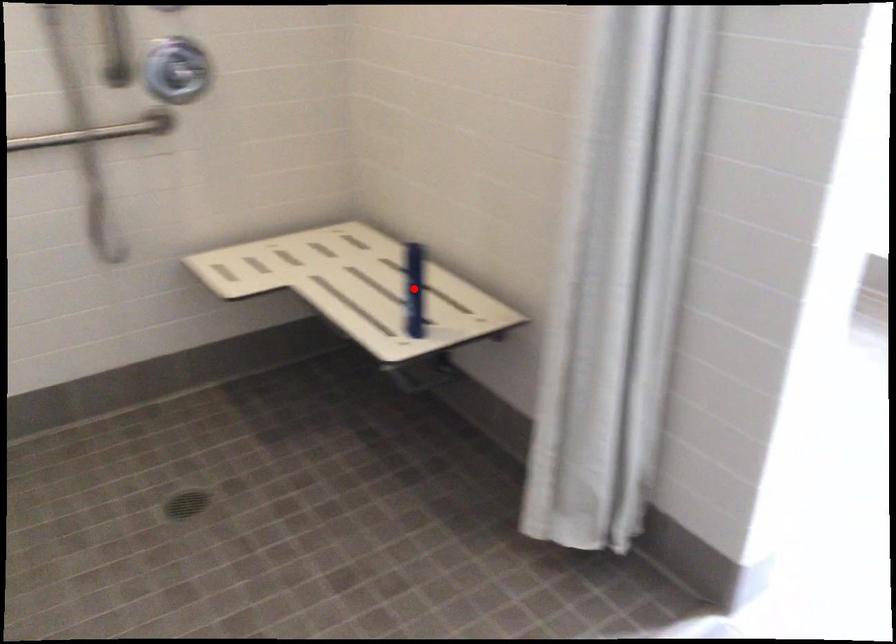
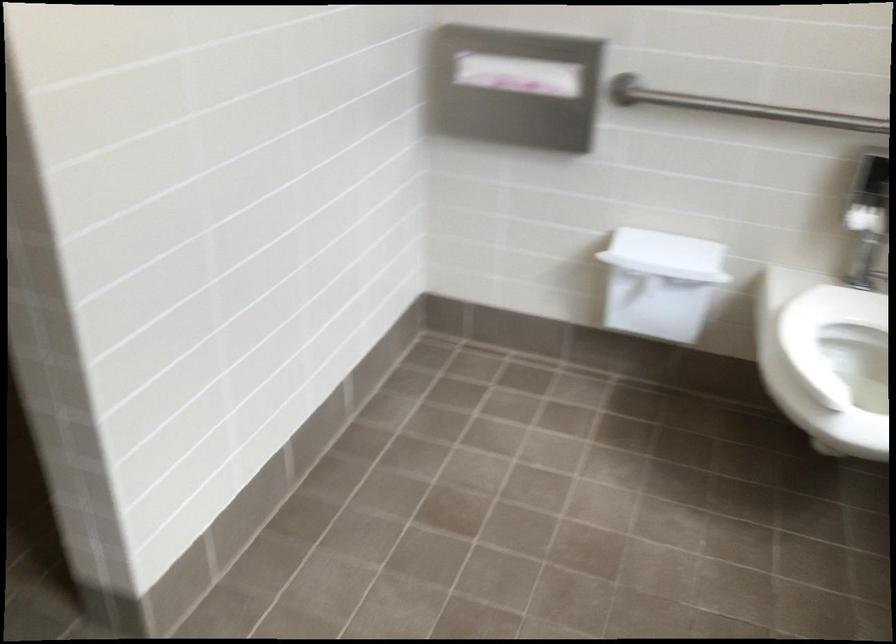
Question: I am providing you with two images of the same scene from different viewpoints. A red point is marked on the first image. At the location where the point appears in image 1, is it still visible in image 2?

Choices:
 (A) Yes
 (B) No

Answer: (B)